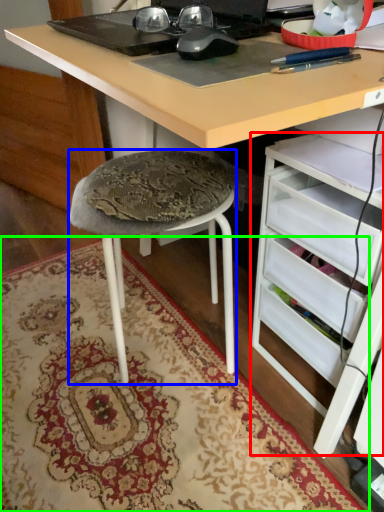
Question: Based on their relative distances, which object is farther from file cabinet (highlighted by a red box)? Choose from stool (highlighted by a blue box) and mat (highlighted by a green box).

Choices:
 (A) stool
 (B) mat

Answer: (B)